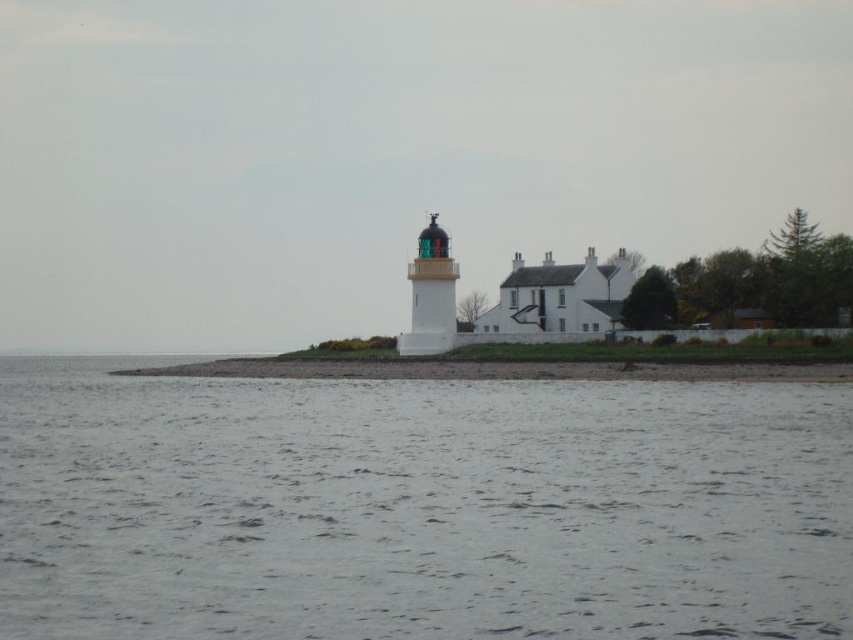
Image resolution: width=853 pixels, height=640 pixels. What do you see at coordinates (496, 369) in the screenshot?
I see `smooth sand at lower center` at bounding box center [496, 369].

From the picture: Which is below, smooth sand at lower center or white painted brick lighthouse at center?

smooth sand at lower center is lower down.

Between point (488, 362) and point (445, 291), which one is positioned behind?

Point (445, 291)

You are a GUI agent. You are given a task and a screenshot of the screen. Output one action in this format:
    pyautogui.click(x=<x>, y=<y>)
    Task: Click on the smooth sand at lower center
    
    Given the screenshot: What is the action you would take?
    pyautogui.click(x=496, y=369)

Can you confirm if gray water at lower center is positioned to the left of smooth sand at lower center?

No, gray water at lower center is not to the left of smooth sand at lower center.

Who is taller, gray water at lower center or smooth sand at lower center?

Standing taller between the two is smooth sand at lower center.

Who is more forward, [729,545] or [515,372]?

Point [729,545] is more forward.

Image resolution: width=853 pixels, height=640 pixels. In order to click on gray water at lower center in this screenshot , I will do `click(419, 508)`.

The image size is (853, 640). What do you see at coordinates (419, 508) in the screenshot? I see `gray water at lower center` at bounding box center [419, 508].

Locate an element on the screen. This screenshot has width=853, height=640. gray water at lower center is located at coordinates (419, 508).